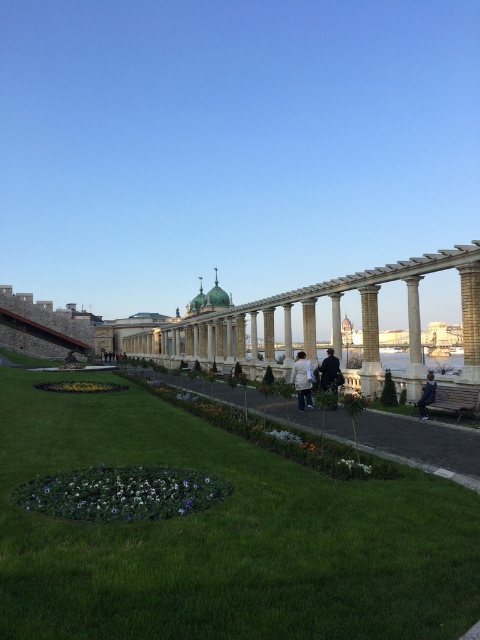
You are a visitor in the park and you see the green grass at center and the dark blue jacket at center. Which object is closer to the ground?

The green grass at center is closer to the ground as it is located below the dark blue jacket at center.

You are standing in the park and see the green grass at center and the white fabric jacket at center. Which object is positioned lower in the scene?

The green grass at center is positioned lower than the white fabric jacket at center.